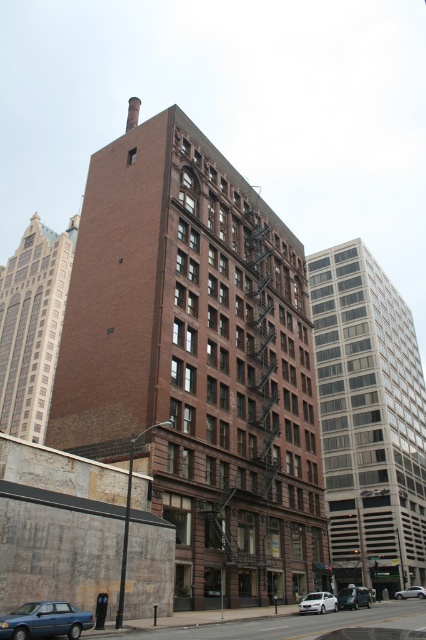
Looking at this image, you are a delivery driver who needs to park your vehicle in a parking spot that requires vehicles to be no taller than 1.5 meters. You have a blue metallic sedan at lower left and a silver metallic sedan at lower right. Which vehicle can you park without exceeding the height limit?

The blue metallic sedan at lower left has a lesser height compared to the silver metallic sedan at lower right. Since the parking spot requires vehicles to be no taller than 1.5 meters, the blue metallic sedan at lower left is more likely to comply with the height restriction.

You are a delivery person needing to park your 2.5 meter wide truck between the white matte car at lower center and the silver metallic sedan at lower right. Can you fit your truck between them?

The distance between the white matte car at lower center and the silver metallic sedan at lower right is 5.63 meters. Since your truck is 2.5 meters wide, there is enough space to park between them as 5.63 meters is greater than 2.5 meters.